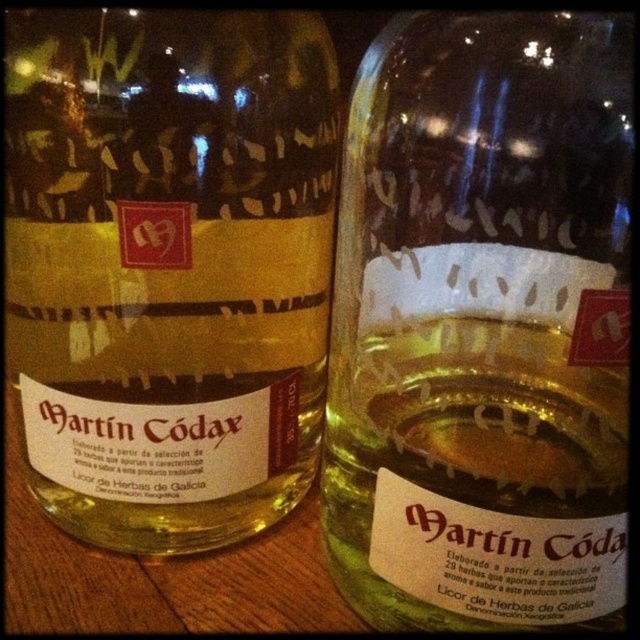
You are looking at two bottles of Martin Coddax Licor de Herbas de Galicia on a wooden table. The bottles are positioned side by side. Which one is lower in position between the translucent glass bottle at center and the matte glass bottle at center?

The translucent glass bottle at center is lower than the matte glass bottle at center because it is positioned below it.

Based on the photo, you are standing in front of two bottles of Martin Coddax Licor de Herbas de Galicia placed side by side on a wooden table. You want to pick up the bottle that is closer to you. Which one should you choose between the translucent glass bottle at center and the matte glass bottle at center?

The translucent glass bottle at center is closer to the viewer than the matte glass bottle at center, so you should pick up the translucent glass bottle at center.

You are a bartender preparing a cocktail that requires precise measurements. You have two bottles of Martin C Codax Licor de Herbas de Galicia on the counter. The translucent glass bottle at center and the matte glass bottle at center. Which bottle should you use if you need the larger capacity?

The matte glass bottle at center has a larger capacity than the translucent glass bottle at center, so you should use the matte glass bottle at center for the cocktail that requires precise measurements.